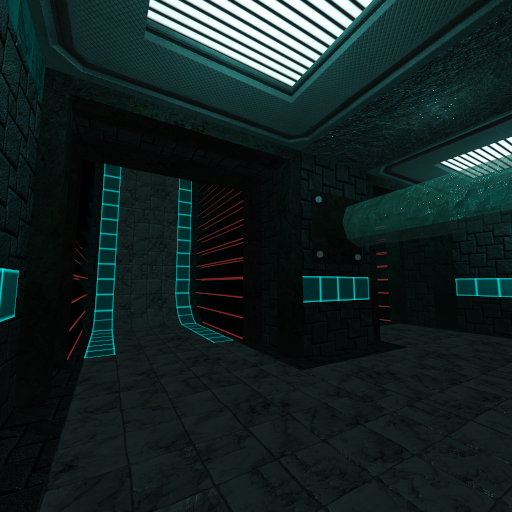
Locate an element on the screen. This screenshot has width=512, height=512. wall is located at coordinates (280, 293).